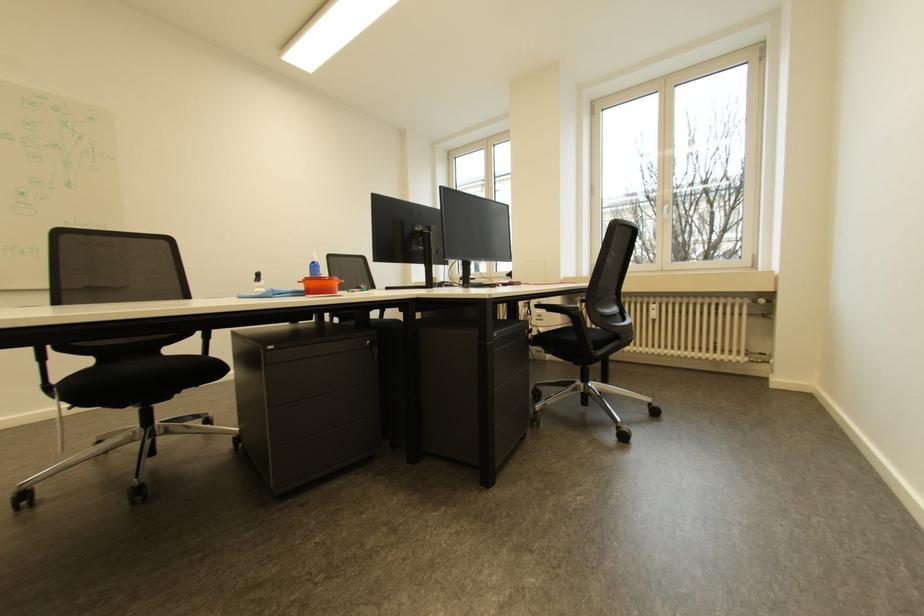
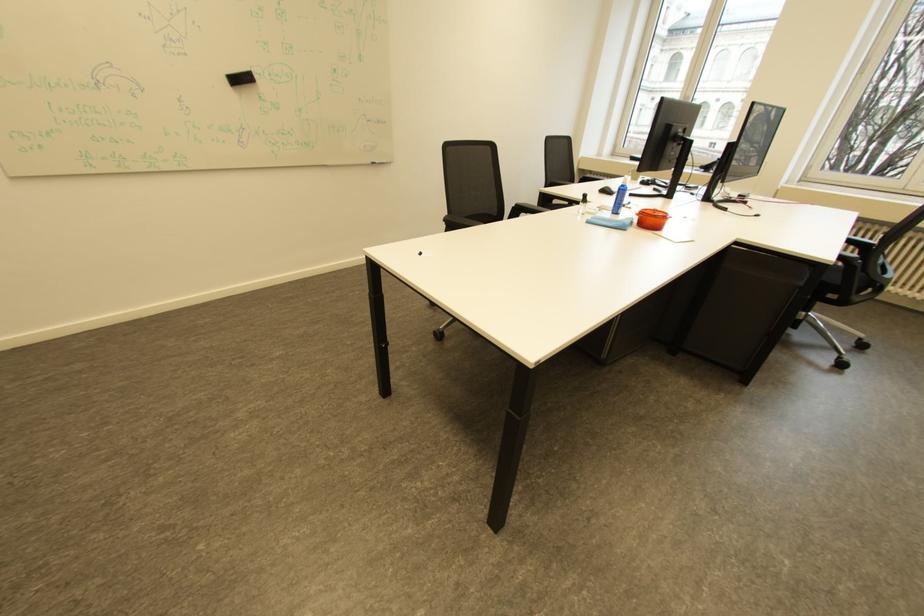
Which direction would the cameraman need to move to produce the second image?

The cameraman moved toward left, backward.